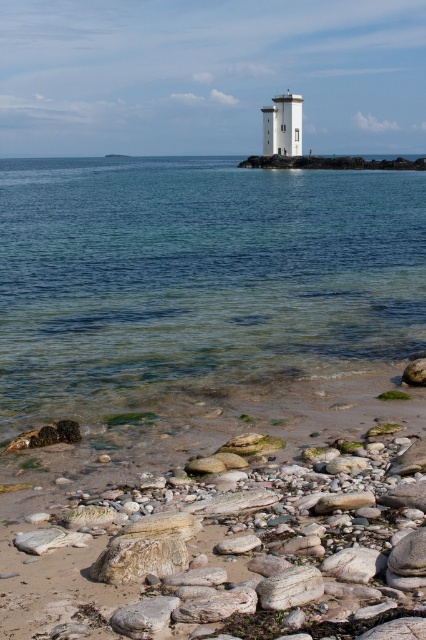
Question: Which of the following is the closest to the observer?

Choices:
 (A) (2, 179)
 (B) (305, 472)

Answer: (B)

Question: Which of the following is the farthest from the observer?

Choices:
 (A) (279, 138)
 (B) (328, 557)
 (C) (143, 360)

Answer: (A)

Question: Can you confirm if clear water at center is smaller than smooth white stones at lower center?

Choices:
 (A) yes
 (B) no

Answer: (B)

Question: Is smooth white stones at lower center thinner than white smooth tower at center?

Choices:
 (A) no
 (B) yes

Answer: (A)

Question: Does clear water at center have a greater width compared to white smooth tower at center?

Choices:
 (A) yes
 (B) no

Answer: (A)

Question: Among these points, which one is farthest from the camera?

Choices:
 (A) (322, 531)
 (B) (285, 97)
 (C) (97, 170)

Answer: (C)